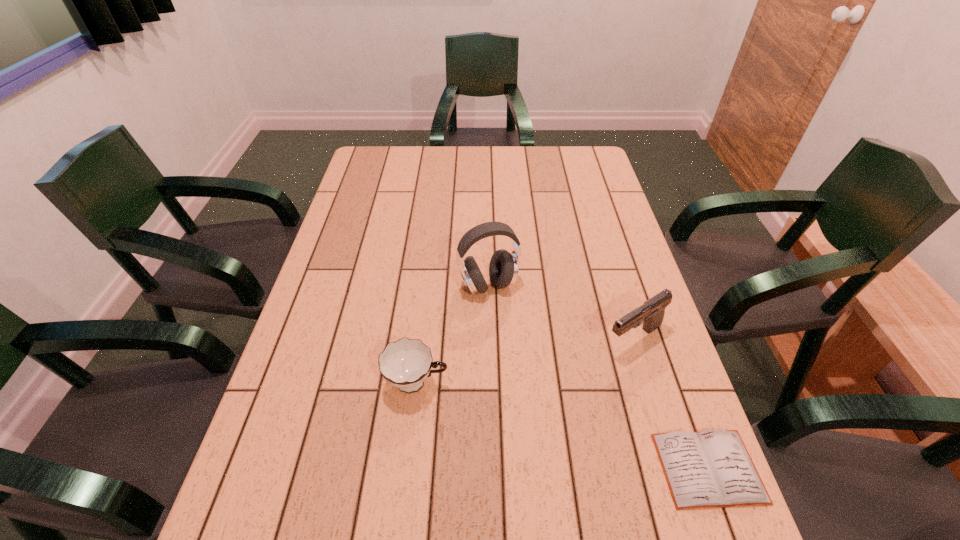
Identify the location of empty space that is in between the pistol and the nearest object. The height and width of the screenshot is (540, 960). (671, 403).

This screenshot has height=540, width=960. I want to click on free area in between the shortest object and the cup, so click(563, 426).

Locate an element on the screen. This screenshot has width=960, height=540. free spot between the diary and the second shortest object is located at coordinates (563, 426).

Image resolution: width=960 pixels, height=540 pixels. In order to click on vacant space that's between the farthest object and the shortest object in this screenshot , I will do `click(598, 377)`.

Locate an element on the screen. The image size is (960, 540). free space that is in between the third shortest object and the farthest object is located at coordinates (561, 313).

Where is `free space between the second object from left to right and the pistol`? free space between the second object from left to right and the pistol is located at coordinates (561, 313).

Locate which object ranks in proximity to the shortest object. Please provide its 2D coordinates. Your answer should be formatted as a tuple, i.e. [(x, y)], where the tuple contains the x and y coordinates of a point satisfying the conditions above.

[(651, 314)]

Identify which object is located as the nearest to the second object from left to right. Please provide its 2D coordinates. Your answer should be formatted as a tuple, i.e. [(x, y)], where the tuple contains the x and y coordinates of a point satisfying the conditions above.

[(405, 364)]

Where is `vacant space that satisfies the following two spatial constraints: 1. on the front side of the headset; 2. on the left side of the diary`? This screenshot has height=540, width=960. vacant space that satisfies the following two spatial constraints: 1. on the front side of the headset; 2. on the left side of the diary is located at coordinates (492, 468).